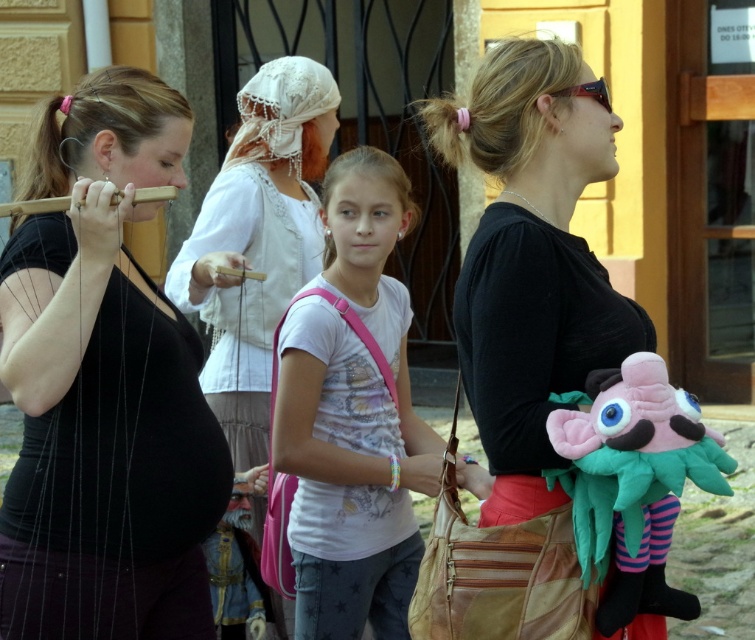
Measure the distance from black matte shirt at left to white printed t-shirt at center.

84.00 centimeters

Measure the distance between point (180, 404) and camera.

Point (180, 404) and camera are 12.42 feet apart from each other.

The image size is (755, 640). I want to click on black matte shirt at left, so click(x=103, y=387).

Does matte black plush toy at center appear over white lace headscarf at center?

Incorrect, matte black plush toy at center is not positioned above white lace headscarf at center.

From the picture: Between matte black plush toy at center and white lace headscarf at center, which one is positioned lower?

matte black plush toy at center is below.

The width and height of the screenshot is (755, 640). What do you see at coordinates (532, 259) in the screenshot?
I see `matte black plush toy at center` at bounding box center [532, 259].

I want to click on matte black plush toy at center, so click(x=532, y=259).

Can you confirm if pink plush toy at right is taller than wooden flute at left?

Indeed, pink plush toy at right has a greater height compared to wooden flute at left.

Does pink plush toy at right appear under wooden flute at left?

Correct, pink plush toy at right is located below wooden flute at left.

Who is more forward, (683, 412) or (5, 209)?

Point (683, 412) is more forward.

The image size is (755, 640). I want to click on pink plush toy at right, so click(633, 481).